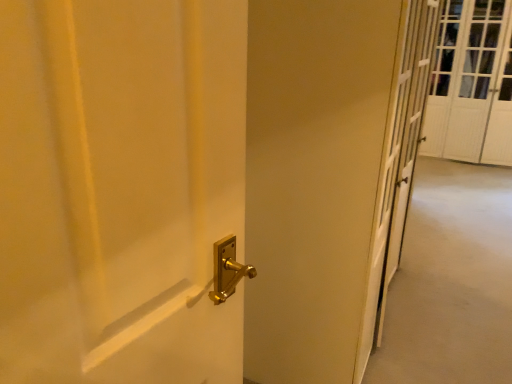
Question: Looking at their shapes, would you say white textured screen door at upper right is wider or thinner than gold metallic door handle at center?

Choices:
 (A) thin
 (B) wide

Answer: (A)

Question: In terms of size, does white textured screen door at upper right appear bigger or smaller than gold metallic door handle at center?

Choices:
 (A) small
 (B) big

Answer: (B)

Question: From the image's perspective, relative to gold metallic door handle at center, is white textured screen door at upper right above or below?

Choices:
 (A) below
 (B) above

Answer: (B)

Question: Considering the relative positions of gold metallic door handle at center and white textured screen door at upper right in the image provided, is gold metallic door handle at center to the left or to the right of white textured screen door at upper right?

Choices:
 (A) right
 (B) left

Answer: (B)

Question: In terms of height, does gold metallic door handle at center look taller or shorter compared to white textured screen door at upper right?

Choices:
 (A) short
 (B) tall

Answer: (A)

Question: From a real-world perspective, is gold metallic door handle at center above or below white textured screen door at upper right?

Choices:
 (A) below
 (B) above

Answer: (A)

Question: Does point tap(489, 375) appear closer or farther from the camera than point tap(438, 82)?

Choices:
 (A) closer
 (B) farther

Answer: (A)